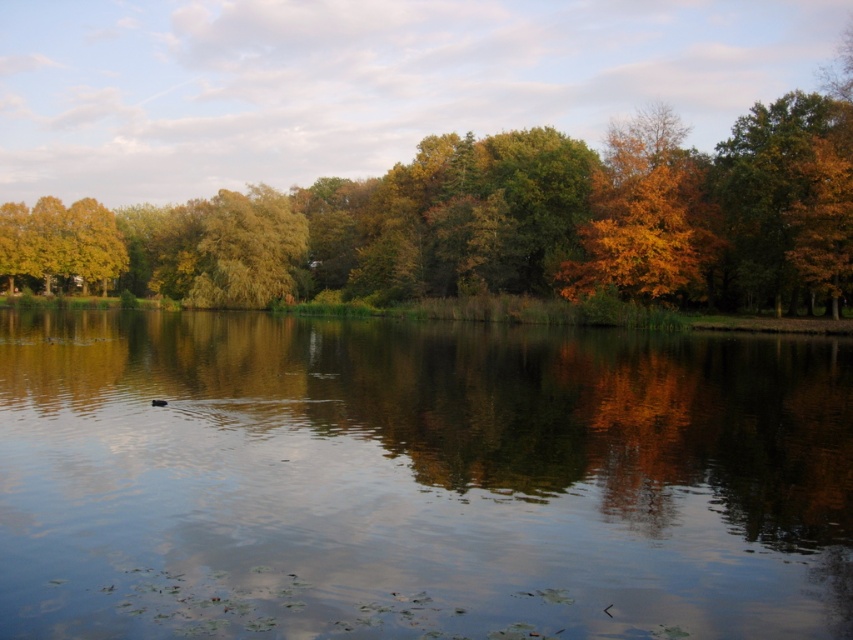
Question: Is transparent water at center positioned in front of green leafy tree at center?

Choices:
 (A) yes
 (B) no

Answer: (A)

Question: Among these objects, which one is nearest to the camera?

Choices:
 (A) transparent water at center
 (B) green leafy tree at center

Answer: (A)

Question: Is transparent water at center below green leafy tree at center?

Choices:
 (A) yes
 (B) no

Answer: (A)

Question: Is transparent water at center to the right of green leafy tree at center from the viewer's perspective?

Choices:
 (A) yes
 (B) no

Answer: (A)